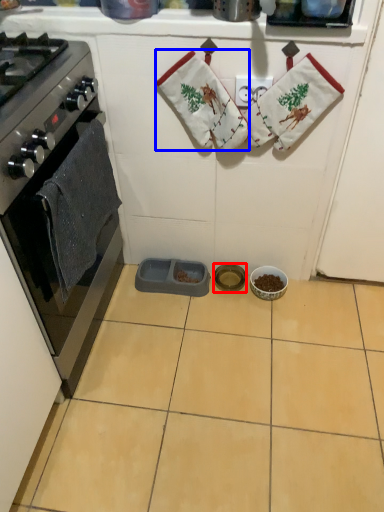
Question: Which object appears farthest to the camera in this image, appliance (highlighted by a red box) or hand towel (highlighted by a blue box)?

Choices:
 (A) appliance
 (B) hand towel

Answer: (A)